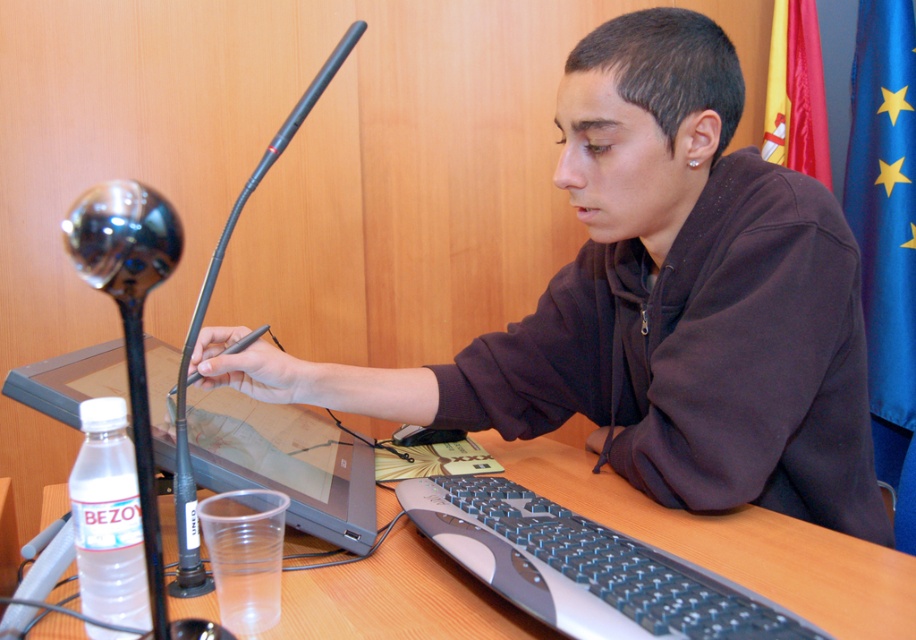
Does matte black laptop at center have a greater width compared to wooden table at center?

No, matte black laptop at center is not wider than wooden table at center.

Who is higher up, matte black laptop at center or wooden table at center?

Positioned higher is matte black laptop at center.

This screenshot has width=916, height=640. Describe the element at coordinates (660, 304) in the screenshot. I see `matte black laptop at center` at that location.

Locate an element on the screen. The height and width of the screenshot is (640, 916). matte black laptop at center is located at coordinates (660, 304).

Does silver/black keyboard at lower center appear on the left side of matte black laptop at left?

Incorrect, silver/black keyboard at lower center is not on the left side of matte black laptop at left.

Can you confirm if silver/black keyboard at lower center is taller than matte black laptop at left?

In fact, silver/black keyboard at lower center may be shorter than matte black laptop at left.

Which is behind, point (606, 602) or point (255, 417)?

Point (255, 417)

At what (x,y) coordinates should I click in order to perform the action: click on silver/black keyboard at lower center. Please return your answer as a coordinate pair (x, y). Looking at the image, I should click on (584, 566).

Is matte black laptop at center above black plastic mouse at center?

Yes.

Is matte black laptop at center wider than black plastic mouse at center?

Correct, the width of matte black laptop at center exceeds that of black plastic mouse at center.

Is point (717, 502) closer to camera compared to point (406, 433)?

Yes, point (717, 502) is in front of point (406, 433).

The image size is (916, 640). Identify the location of matte black laptop at center. (660, 304).